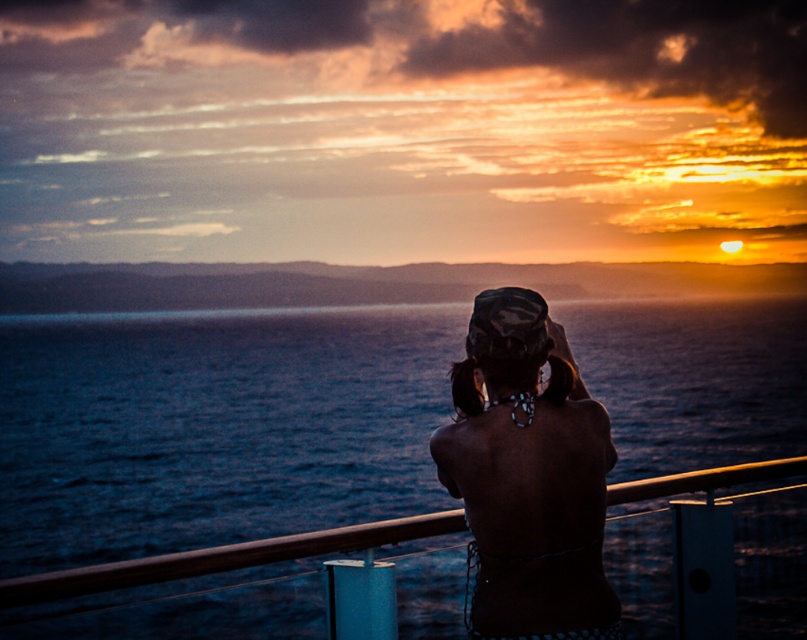
Question: Can you confirm if dark blue water at center is bigger than black matte hat at center?

Choices:
 (A) yes
 (B) no

Answer: (A)

Question: Which object appears farthest from the camera in this image?

Choices:
 (A) black matte hat at center
 (B) dark blue water at center
 (C) matte black bikini top at center

Answer: (B)

Question: Which point appears closest to the camera in this image?

Choices:
 (A) (559, 540)
 (B) (479, 337)
 (C) (224, 316)

Answer: (A)

Question: Does dark blue water at center appear on the right side of matte black bikini top at center?

Choices:
 (A) yes
 (B) no

Answer: (B)

Question: Observing the image, what is the correct spatial positioning of dark blue water at center in reference to matte black bikini top at center?

Choices:
 (A) below
 (B) above

Answer: (A)

Question: Estimate the real-world distances between objects in this image. Which object is closer to the black matte hat at center?

Choices:
 (A) dark blue water at center
 (B) matte black bikini top at center

Answer: (B)